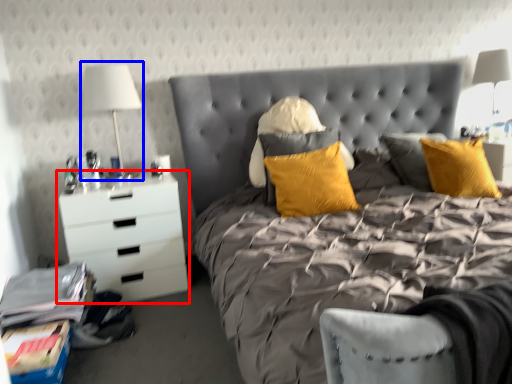
Question: Which of the following is the closest to the observer, chest of drawers (highlighted by a red box) or bedside lamp (highlighted by a blue box)?

Choices:
 (A) chest of drawers
 (B) bedside lamp

Answer: (A)